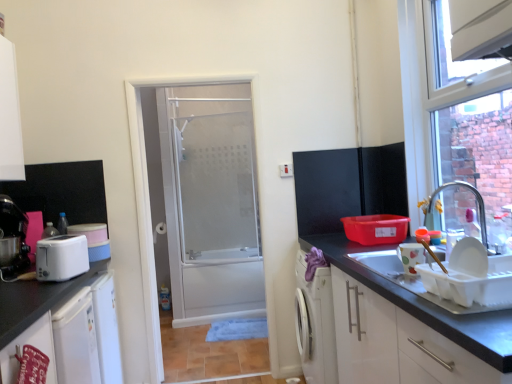
Question: Considering the relative positions of white plastic toaster at left, which appears as the second appliance when viewed from the front, and matte black cabinet at upper right in the image provided, is white plastic toaster at left, which appears as the second appliance when viewed from the front, in front of matte black cabinet at upper right?

Choices:
 (A) no
 (B) yes

Answer: (B)

Question: Is white plastic toaster at left, which ranks as the 1th appliance in left-to-right order, with matte black cabinet at upper right?

Choices:
 (A) yes
 (B) no

Answer: (B)

Question: Is white plastic toaster at left, acting as the second appliance starting from the right, facing towards matte black cabinet at upper right?

Choices:
 (A) no
 (B) yes

Answer: (A)

Question: From a real-world perspective, is white plastic toaster at left, acting as the second appliance starting from the right, positioned over matte black cabinet at upper right based on gravity?

Choices:
 (A) no
 (B) yes

Answer: (A)

Question: Is white plastic toaster at left, which ranks as the 1th appliance in left-to-right order, smaller than matte black cabinet at upper right?

Choices:
 (A) no
 (B) yes

Answer: (B)

Question: In the image, is frosted glass shower door at center on the left side or the right side of matte black cabinet at upper right?

Choices:
 (A) right
 (B) left

Answer: (B)

Question: From a real-world perspective, relative to matte black cabinet at upper right, is frosted glass shower door at center vertically above or below?

Choices:
 (A) above
 (B) below

Answer: (A)

Question: Which is correct: frosted glass shower door at center is inside matte black cabinet at upper right, or outside of it?

Choices:
 (A) inside
 (B) outside

Answer: (B)

Question: Is frosted glass shower door at center in front of or behind matte black cabinet at upper right in the image?

Choices:
 (A) front
 (B) behind

Answer: (B)

Question: Is matte ceramic cup at right, the 1th appliance in the right-to-left sequence, in front of or behind white frosted glass door at center in the image?

Choices:
 (A) behind
 (B) front

Answer: (B)

Question: Choose the correct answer: Is matte ceramic cup at right, marked as the 2th appliance in a left-to-right arrangement, inside white frosted glass door at center or outside it?

Choices:
 (A) outside
 (B) inside

Answer: (A)

Question: From their relative heights in the image, would you say matte ceramic cup at right, marked as the 2th appliance in a left-to-right arrangement, is taller or shorter than white frosted glass door at center?

Choices:
 (A) short
 (B) tall

Answer: (A)

Question: Considering the positions of matte ceramic cup at right, the 1th appliance in the right-to-left sequence, and white frosted glass door at center in the image, is matte ceramic cup at right, the 1th appliance in the right-to-left sequence, bigger or smaller than white frosted glass door at center?

Choices:
 (A) big
 (B) small

Answer: (B)

Question: From a real-world perspective, is white frosted glass door at center above or below white glossy cabinet at lower right, which is counted as the 3th cabinetry, starting from the left?

Choices:
 (A) above
 (B) below

Answer: (A)

Question: From their relative heights in the image, would you say white frosted glass door at center is taller or shorter than white glossy cabinet at lower right, which is counted as the 3th cabinetry, starting from the left?

Choices:
 (A) tall
 (B) short

Answer: (A)